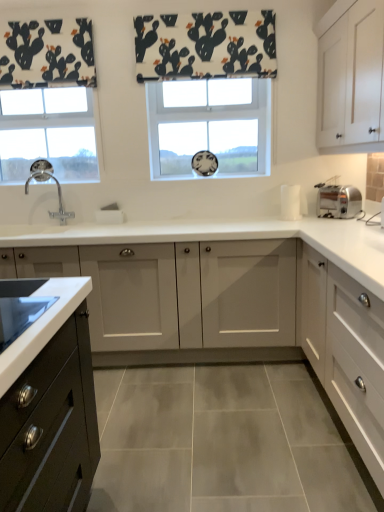
Question: In the image, is white matte cabinet at right, the 1th cabinetry in the bottom-to-top sequence, on the left side or the right side of white fabric with cactus print at upper center?

Choices:
 (A) left
 (B) right

Answer: (B)

Question: Considering the positions of point (337, 325) and point (150, 53), is point (337, 325) closer or farther from the camera than point (150, 53)?

Choices:
 (A) farther
 (B) closer

Answer: (B)

Question: Which object is positioned closest to the clear glass window at left, marked as the 2th window in a right-to-left arrangement?

Choices:
 (A) silver metallic toaster at right
 (B) white glass window at center, which is counted as the first window, starting from the right
 (C) white matte cabinet at upper right, the 1th cabinetry when ordered from top to bottom
 (D) white matte cabinet at right, the 1th cabinetry in the bottom-to-top sequence
 (E) white matte cabinet at center, marked as the third cabinetry in a top-to-bottom arrangement

Answer: (B)

Question: Estimate the real-world distances between objects in this image. Which object is closer to the white matte cabinet at right, the 1th cabinetry in the bottom-to-top sequence?

Choices:
 (A) white matte cabinet at center, marked as the third cabinetry in a top-to-bottom arrangement
 (B) silver metallic toaster at right
 (C) clear glass window at left, marked as the 2th window in a right-to-left arrangement
 (D) white glass window at center, which is counted as the first window, starting from the right
 (E) polished chrome faucet at left

Answer: (A)